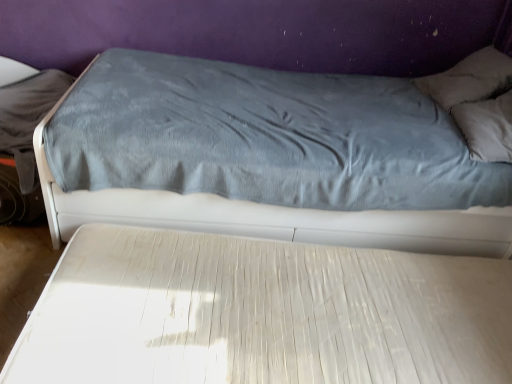
Question: From a real-world perspective, is white textured mattress at center, which is counted as the 2th bed, starting from the top, physically located above or below velvet blue bed at upper center, placed as the first bed when sorted from top to bottom?

Choices:
 (A) below
 (B) above

Answer: (A)

Question: Is white textured mattress at center, the first bed from the bottom, in front of or behind velvet blue bed at upper center, placed as the first bed when sorted from top to bottom, in the image?

Choices:
 (A) behind
 (B) front

Answer: (B)

Question: Estimate the real-world distances between objects in this image. Which object is closer to the velvet blue bed at upper center, the 2th bed positioned from the bottom?

Choices:
 (A) gray soft pillow at upper right
 (B) white textured mattress at center, the first bed from the bottom

Answer: (B)

Question: Which object is the farthest from the gray soft pillow at upper right?

Choices:
 (A) velvet blue bed at upper center, the 2th bed positioned from the bottom
 (B) white textured mattress at center, which is counted as the 2th bed, starting from the top

Answer: (B)